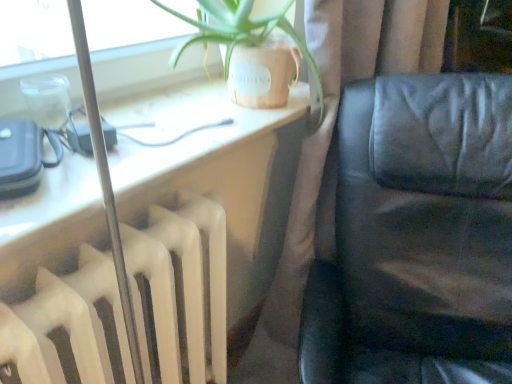
Question: Is brown fabric curtain at center at the right side of black leather couch at right?

Choices:
 (A) yes
 (B) no

Answer: (B)

Question: Is brown fabric curtain at center not close to black leather couch at right?

Choices:
 (A) yes
 (B) no

Answer: (B)

Question: Is brown fabric curtain at center aimed at black leather couch at right?

Choices:
 (A) yes
 (B) no

Answer: (A)

Question: Is black leather couch at right surrounded by brown fabric curtain at center?

Choices:
 (A) yes
 (B) no

Answer: (B)

Question: From a real-world perspective, is brown fabric curtain at center beneath black leather couch at right?

Choices:
 (A) no
 (B) yes

Answer: (A)

Question: Is brown fabric curtain at center bigger than black leather couch at right?

Choices:
 (A) yes
 (B) no

Answer: (B)

Question: Is black leather couch at right with brown fabric curtain at center?

Choices:
 (A) yes
 (B) no

Answer: (B)

Question: Is black leather couch at right completely or partially outside of brown fabric curtain at center?

Choices:
 (A) yes
 (B) no

Answer: (A)

Question: Is black leather couch at right not near brown fabric curtain at center?

Choices:
 (A) yes
 (B) no

Answer: (B)

Question: Can you confirm if black leather couch at right is shorter than brown fabric curtain at center?

Choices:
 (A) yes
 (B) no

Answer: (A)

Question: Can you confirm if black leather couch at right is wider than brown fabric curtain at center?

Choices:
 (A) yes
 (B) no

Answer: (A)

Question: Considering the relative positions of black leather couch at right and brown fabric curtain at center in the image provided, is black leather couch at right to the right of brown fabric curtain at center from the viewer's perspective?

Choices:
 (A) no
 (B) yes

Answer: (B)

Question: Is matte black leather couch at right at the back of brown fabric curtain at center?

Choices:
 (A) yes
 (B) no

Answer: (B)